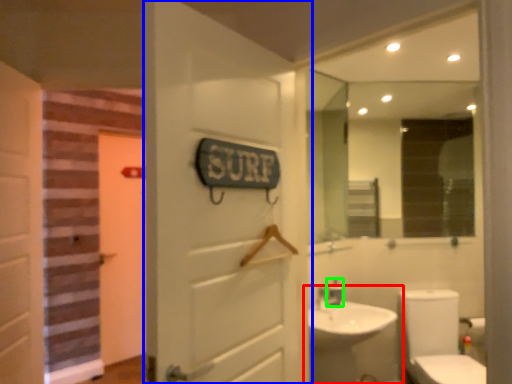
Question: Based on their relative distances, which object is nearer to sink (highlighted by a red box)? Choose from door (highlighted by a blue box) and faucet (highlighted by a green box).

Choices:
 (A) door
 (B) faucet

Answer: (B)